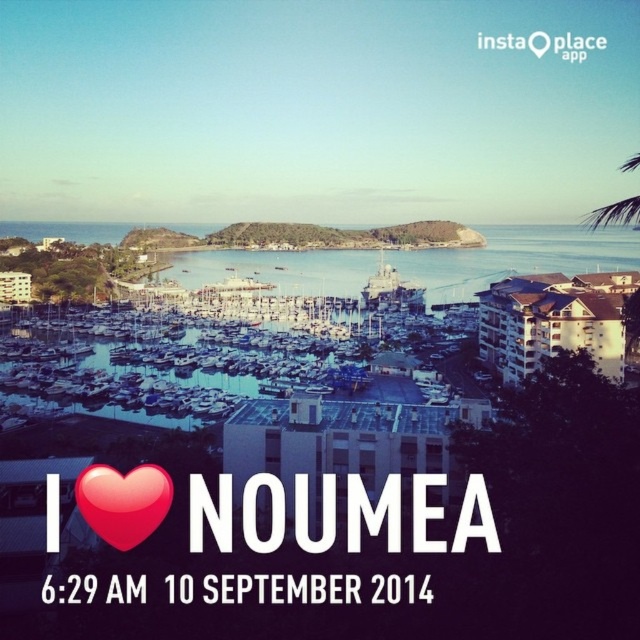
You are an observer standing at the edge of the marina. You notice two objects at the center of the scene. Which one is larger between the blue water at center and the red glossy heart at center?

The blue water at center is bigger than the red glossy heart at center.

You are a photographer standing at the edge of the marina. You want to capture a photo that includes both the blue water at center and the red glossy heart at center. Which object will appear closer to the camera in the photo?

The blue water at center appears closer to the camera in the photo because it is further to the viewer than the red glossy heart at center.

You are standing at the edge of the marina and want to take a photo of the blue water at center. Which direction should you face to capture it in the frame?

The blue water at center is located at point [515,257], so you should face towards the center of the marina to capture it in your photo.